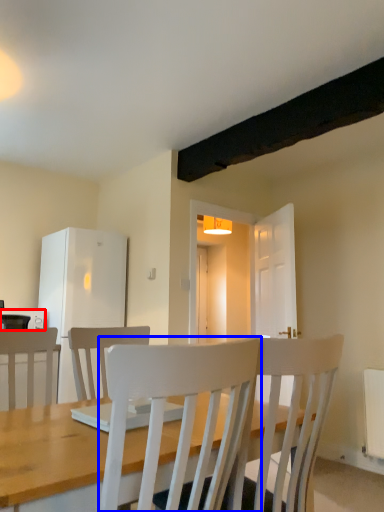
Question: Which object is closer to the camera taking this photo, appliance (highlighted by a red box) or chair (highlighted by a blue box)?

Choices:
 (A) appliance
 (B) chair

Answer: (B)